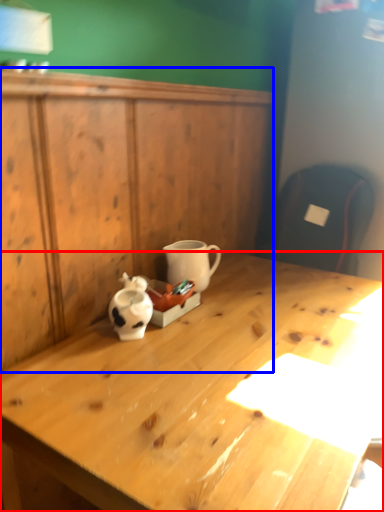
Question: Which object appears farthest to the camera in this image, desk (highlighted by a red box) or dresser (highlighted by a blue box)?

Choices:
 (A) desk
 (B) dresser

Answer: (B)